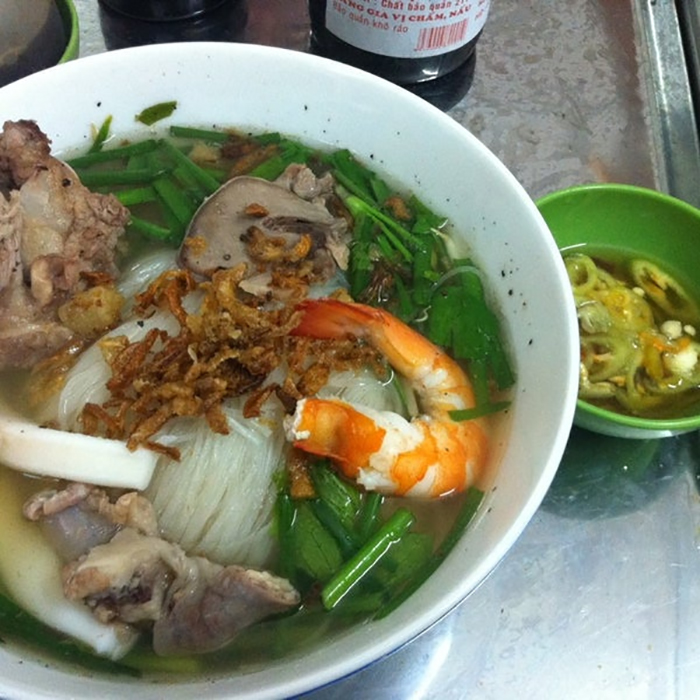
Image resolution: width=700 pixels, height=700 pixels. Identify the location of white bowl. (x=558, y=414).